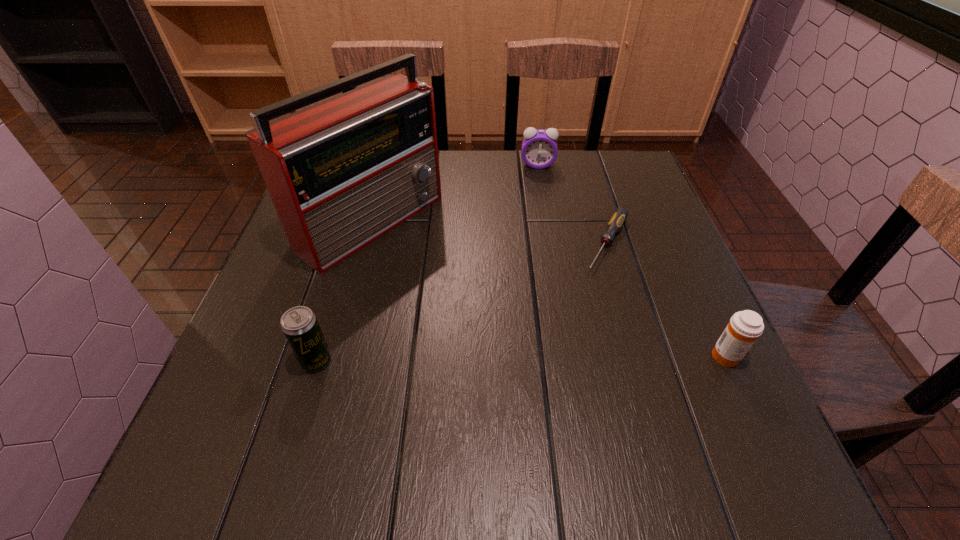
This screenshot has width=960, height=540. Find the location of `free space on the desktop that is between the beer can and the medicine and is positioned insert the second object from right to left into a screw head`. free space on the desktop that is between the beer can and the medicine and is positioned insert the second object from right to left into a screw head is located at coordinates (542, 358).

The width and height of the screenshot is (960, 540). What are the coordinates of `vacant spot on the desktop that is between the beer can and the rightmost object and is positioned on the face of the alarm clock` in the screenshot? It's located at (543, 358).

I want to click on vacant space on the desktop that is between the beer can and the rightmost object and is positioned on the front-facing side of the tallest object, so click(x=579, y=357).